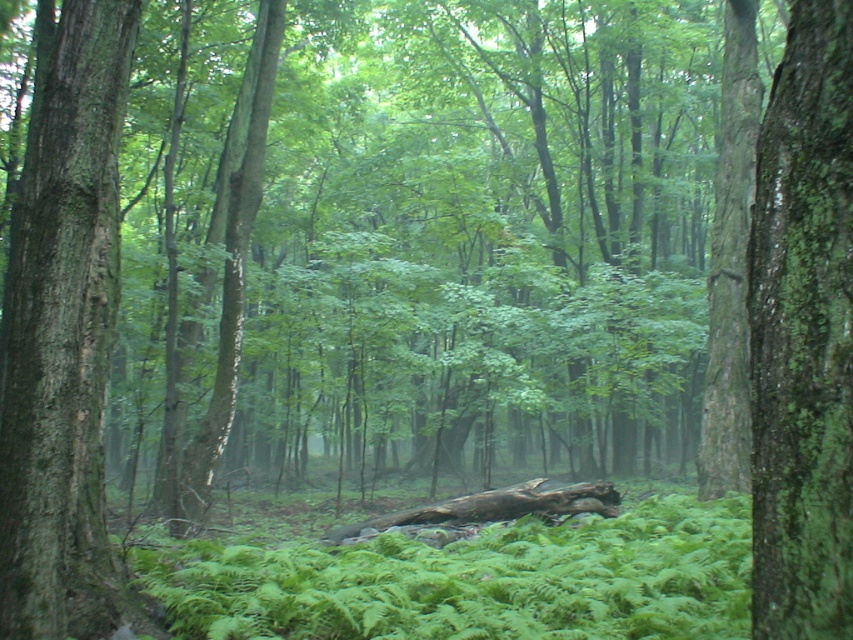
Based on the photo, you are a hiker who wants to climb a tree to get a better view of the forest. Which tree would you choose between the smooth bark tree trunk at left and the brown rough log at center, and why?

The smooth bark tree trunk at left is much taller than the brown rough log at center, so you should choose the smooth bark tree trunk at left to climb for a better view.

You are a hiker trying to cross the forest floor. You see the green mossy bark tree trunk at right and the brown rough log at center. Which one is nearer to you?

The green mossy bark tree trunk at right is closer to the viewer than the brown rough log at center.